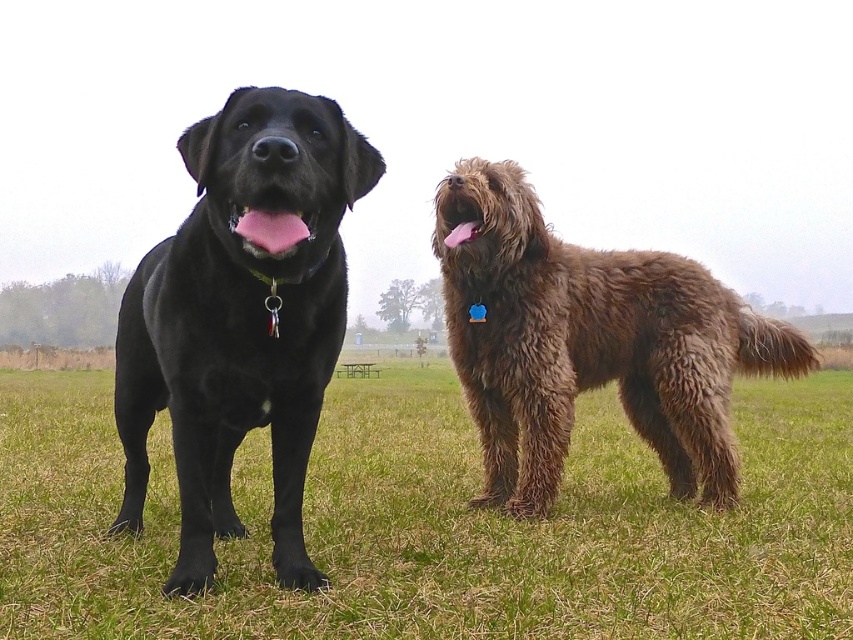
Is green grass at lower center smaller than fuzzy brown dog at right?

No, green grass at lower center is not smaller than fuzzy brown dog at right.

Can you confirm if green grass at lower center is positioned to the right of fuzzy brown dog at right?

Incorrect, green grass at lower center is not on the right side of fuzzy brown dog at right.

Image resolution: width=853 pixels, height=640 pixels. Describe the element at coordinates (434, 524) in the screenshot. I see `green grass at lower center` at that location.

Image resolution: width=853 pixels, height=640 pixels. What are the coordinates of `green grass at lower center` in the screenshot? It's located at (434, 524).

Does matte black dog at left appear under fuzzy brown dog at right?

Indeed, matte black dog at left is positioned under fuzzy brown dog at right.

Identify the location of matte black dog at left. This screenshot has height=640, width=853. (241, 317).

At what (x,y) coordinates should I click in order to perform the action: click on matte black dog at left. Please return your answer as a coordinate pair (x, y). Looking at the image, I should click on (241, 317).

Is green grass at lower center shorter than matte black dog at left?

Yes.

Locate an element on the screen. The image size is (853, 640). green grass at lower center is located at coordinates (434, 524).

Who is more distant from viewer, (491, 541) or (334, 209)?

Point (491, 541)

This screenshot has width=853, height=640. In order to click on green grass at lower center in this screenshot , I will do [x=434, y=524].